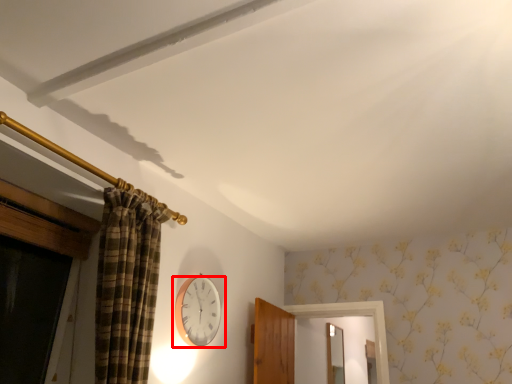
Question: From the image's perspective, where is wall clock (annotated by the red box) located relative to mirror?

Choices:
 (A) below
 (B) above

Answer: (B)